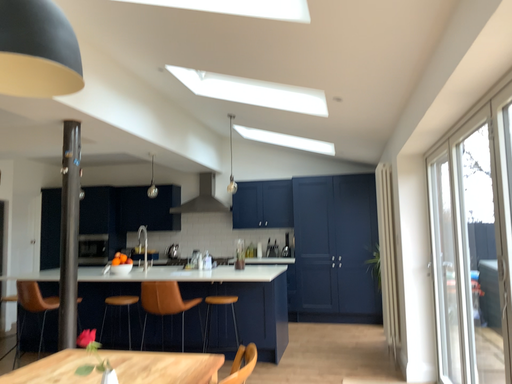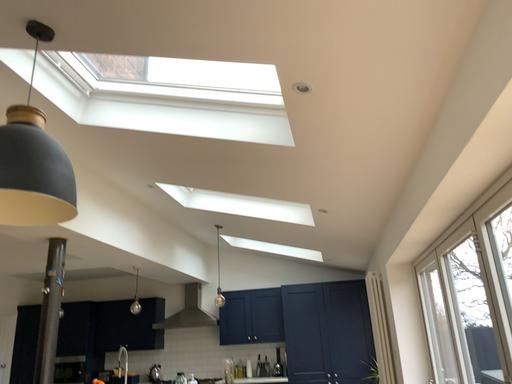
Question: Which way did the camera rotate in the video?

Choices:
 (A) rotated upward
 (B) rotated downward

Answer: (A)